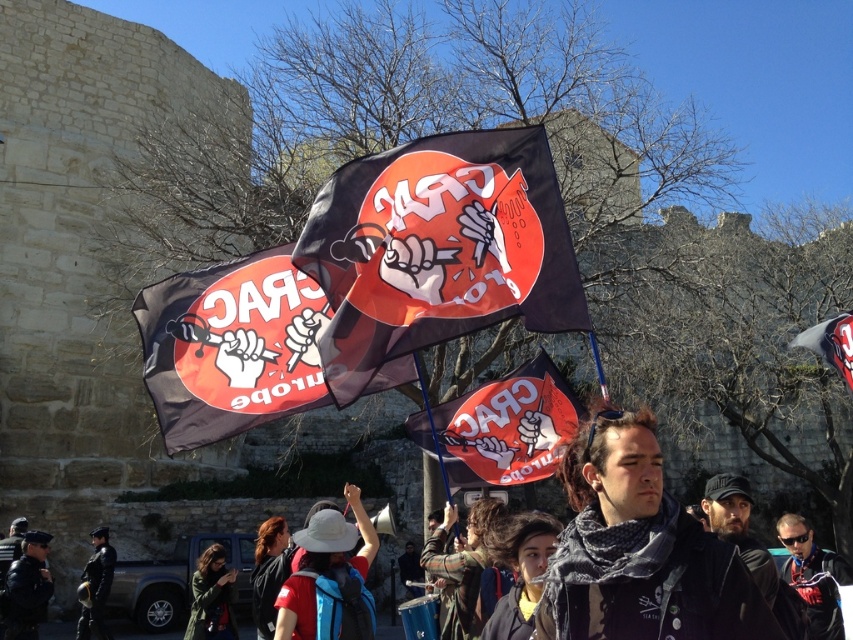
Question: Can you confirm if black leather jacket at lower left is positioned above red fabric flag at upper right?

Choices:
 (A) yes
 (B) no

Answer: (B)

Question: Which point appears farthest from the camera in this image?

Choices:
 (A) (494, 634)
 (B) (33, 573)

Answer: (B)

Question: Does dark brown hair at center appear under black leather jacket at lower left?

Choices:
 (A) yes
 (B) no

Answer: (B)

Question: Which object appears closest to the camera in this image?

Choices:
 (A) black fabric flag at center
 (B) red fabric hat at center

Answer: (A)

Question: Based on their relative distances, which object is nearer to the matte black flag at center?

Choices:
 (A) flannel shirt at center
 (B) black fabric flag at center
 (C) dark gray scarf at center
 (D) dark gray fabric flag at center

Answer: (A)

Question: Is the position of red fabric hat at center less distant than that of flannel shirt at center?

Choices:
 (A) no
 (B) yes

Answer: (B)